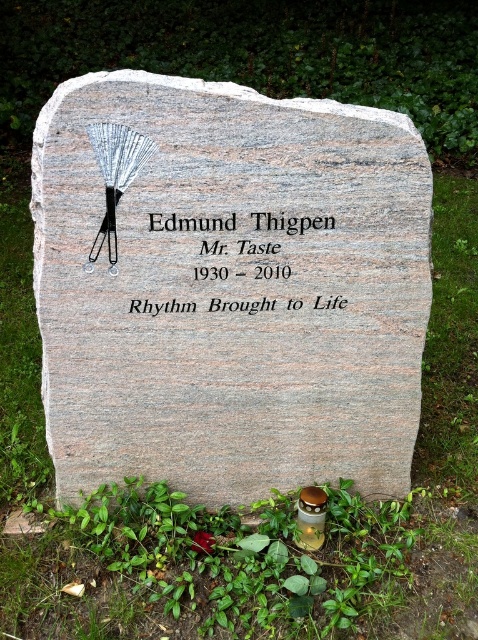
Does green grass at upper center have a lesser height compared to black granite stone at center?

Incorrect, green grass at upper center's height does not fall short of black granite stone at center's.

What do you see at coordinates (431, 461) in the screenshot? The width and height of the screenshot is (478, 640). I see `green grass at upper center` at bounding box center [431, 461].

Who is more forward, (465, 208) or (206, 228)?

Point (206, 228)

Find the location of a particular element. Image resolution: width=478 pixels, height=640 pixels. green grass at upper center is located at coordinates (431, 461).